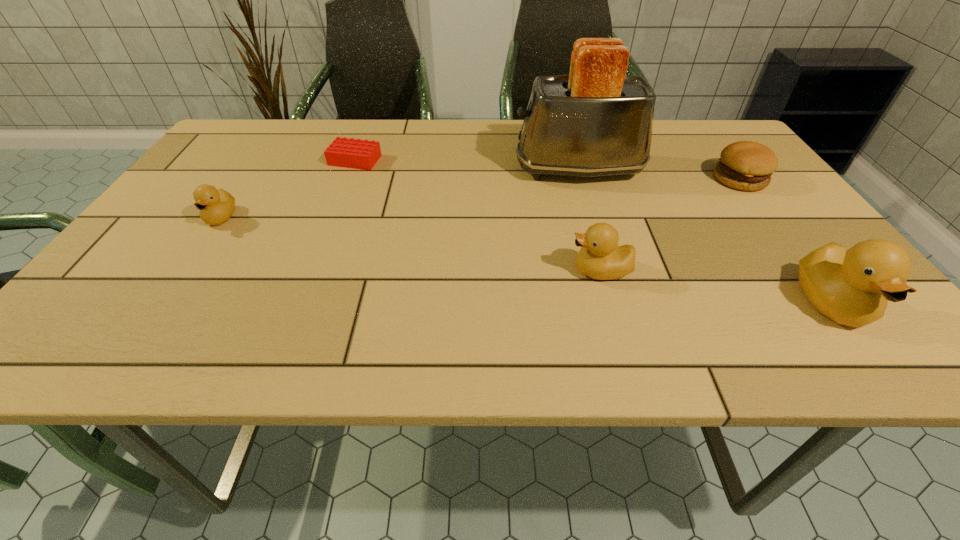
Where is `Lego at the far edge`? Lego at the far edge is located at coordinates (353, 153).

The height and width of the screenshot is (540, 960). Identify the location of object that is at the left edge. (216, 206).

Where is `duckling that is at the right edge`? duckling that is at the right edge is located at coordinates (852, 287).

Find the location of a particular element. The image size is (960, 540). hamburger that is positioned at the right edge is located at coordinates (745, 165).

Find the location of a particular element. The width and height of the screenshot is (960, 540). object located in the near right corner section of the desktop is located at coordinates (852, 287).

Image resolution: width=960 pixels, height=540 pixels. In order to click on vacant region at the far edge of the desktop in this screenshot , I will do `click(499, 137)`.

You are a GUI agent. You are given a task and a screenshot of the screen. Output one action in this format:
    pyautogui.click(x=<x>, y=<y>)
    Task: Click on the vacant space at the near edge of the desktop
    This screenshot has height=540, width=960.
    Given the screenshot: What is the action you would take?
    pyautogui.click(x=558, y=287)

Identify the location of vacant region at the left edge of the desktop. (216, 162).

In order to click on free space at the far left corner of the desktop in this screenshot , I will do `click(237, 129)`.

Where is `vacant space at the far right corner of the desktop`? Image resolution: width=960 pixels, height=540 pixels. vacant space at the far right corner of the desktop is located at coordinates (680, 123).